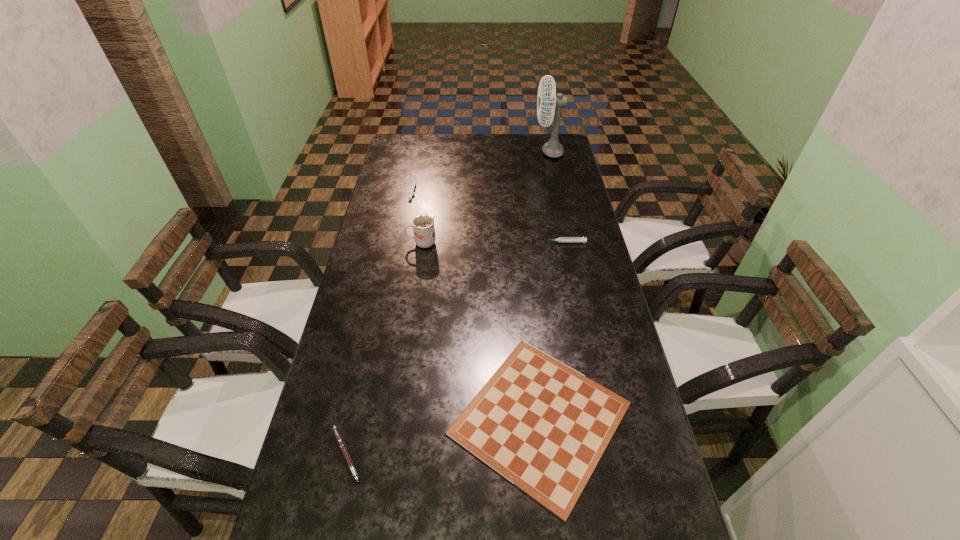
Find the location of a particular element. The height and width of the screenshot is (540, 960). vacant space that is in between the checkerboard and the fifth tallest object is located at coordinates (443, 436).

Where is `the fourth closest object to the fifth nearest object`? the fourth closest object to the fifth nearest object is located at coordinates (543, 426).

Find the location of a particular element. the closest object to the left syringe is located at coordinates (423, 225).

Image resolution: width=960 pixels, height=540 pixels. In order to click on vacant point that satisfies the following two spatial constraints: 1. on the back side of the shortest object; 2. on the side with the handle of the cup in this screenshot , I will do `click(522, 243)`.

Find the location of a particular element. free space that satisfies the following two spatial constraints: 1. on the front side of the fifth nearest object; 2. on the right side of the shortest object is located at coordinates (369, 418).